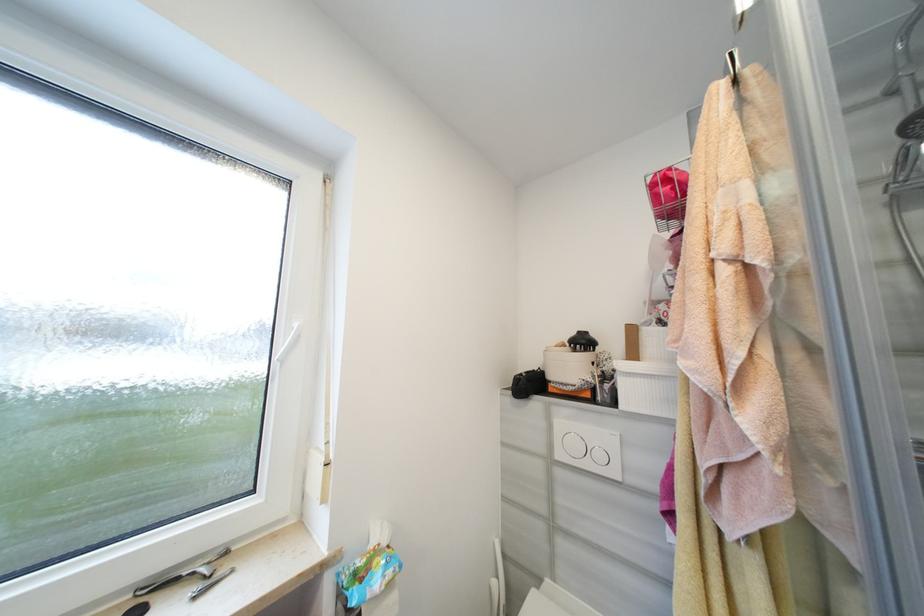
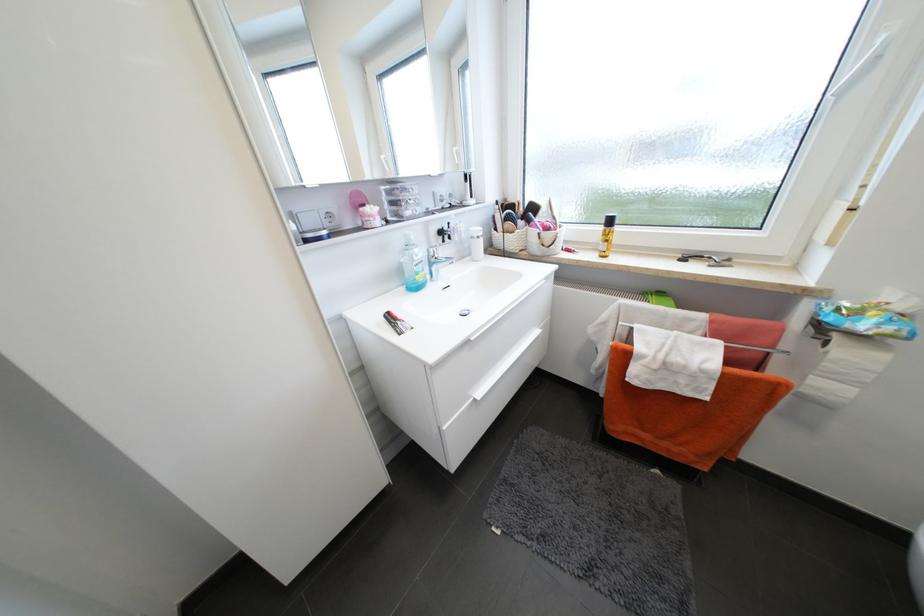
In the second image, find the point that corresponds to point (301, 326) in the first image.

(888, 41)